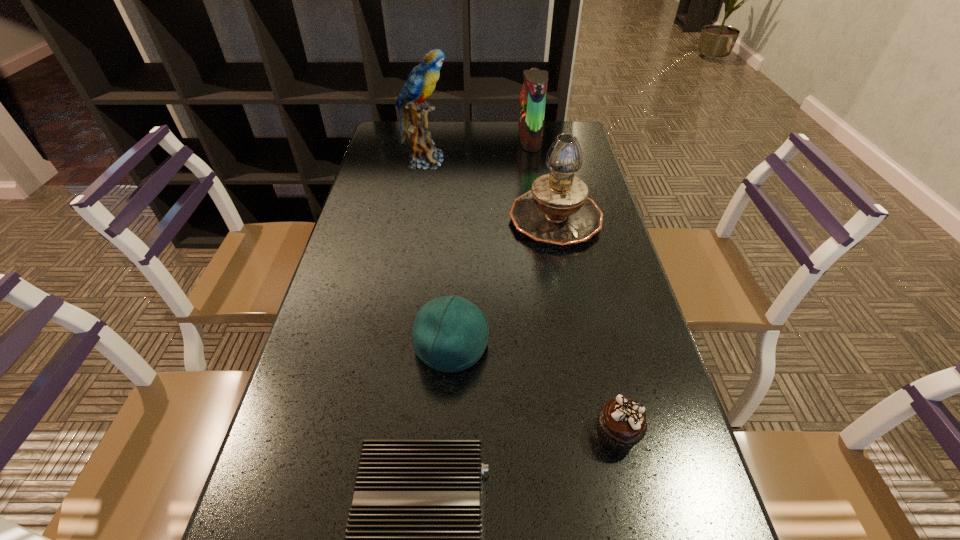
Where is `the tallest object`? the tallest object is located at coordinates pyautogui.click(x=420, y=83).

Where is `the taller parrot`? This screenshot has height=540, width=960. the taller parrot is located at coordinates (420, 83).

You are a GUI agent. You are given a task and a screenshot of the screen. Output one action in this format:
    pyautogui.click(x=<x>, y=<y>)
    Task: Click on the oil lamp
    The width and height of the screenshot is (960, 540).
    Given the screenshot: What is the action you would take?
    pyautogui.click(x=557, y=211)

Image resolution: width=960 pixels, height=540 pixels. Find the location of `the shorter parrot`. the shorter parrot is located at coordinates (533, 94).

Where is `beanie`? The width and height of the screenshot is (960, 540). beanie is located at coordinates (450, 334).

The width and height of the screenshot is (960, 540). Identify the location of the fourth farthest object. (450, 334).

Find the location of `the fifth tallest object`. the fifth tallest object is located at coordinates (621, 423).

This screenshot has width=960, height=540. I want to click on vacant space located 0.280m on the face of the taller parrot, so click(534, 161).

I want to click on free space located on the back of the oil lamp, so click(538, 130).

At what (x,y) coordinates should I click in order to perform the action: click on vacant space situated at the face of the right parrot. Please return your answer as a coordinate pair (x, y). This screenshot has height=540, width=960. Looking at the image, I should click on (463, 140).